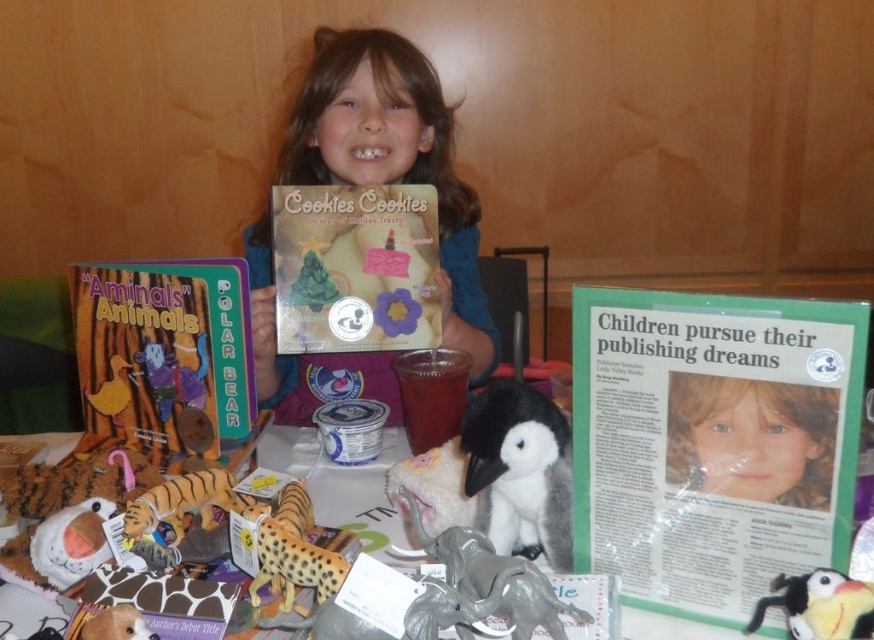
Question: Which point is closer to the camera?

Choices:
 (A) 823,580
 (B) 573,358

Answer: (A)

Question: Observing the image, what is the correct spatial positioning of smooth blue shirt at center in reference to black plush penguin at center?

Choices:
 (A) left
 (B) right

Answer: (A)

Question: Can you confirm if green paper poster at center is thinner than soft plush penguin at center?

Choices:
 (A) no
 (B) yes

Answer: (A)

Question: Which of the following is the closest to the observer?

Choices:
 (A) soft plush penguin at center
 (B) matte board book at left

Answer: (A)

Question: Does green paper poster at center have a greater width compared to soft plush penguin at center?

Choices:
 (A) yes
 (B) no

Answer: (A)

Question: Which point is closer to the camera?

Choices:
 (A) black plush penguin at center
 (B) soft plush penguin at center

Answer: (B)